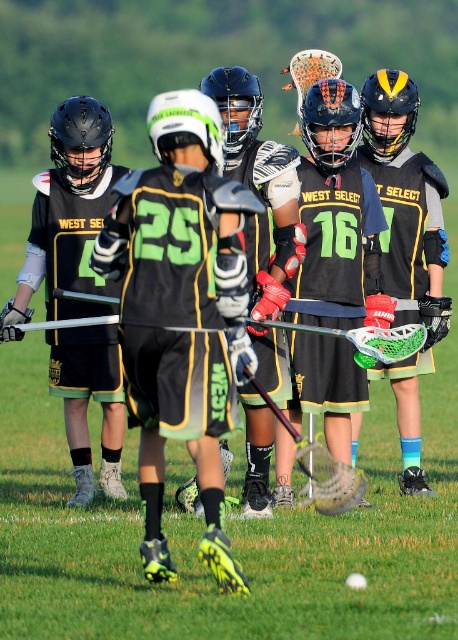
Can you confirm if black matte lacrosse stick at center is positioned above matte black helmet at center?

Indeed, black matte lacrosse stick at center is positioned over matte black helmet at center.

Who is positioned more to the right, black matte lacrosse stick at center or matte black helmet at center?

Positioned to the right is black matte lacrosse stick at center.

The width and height of the screenshot is (458, 640). What are the coordinates of `black matte lacrosse stick at center` in the screenshot? It's located at (228, 531).

This screenshot has width=458, height=640. I want to click on black matte lacrosse stick at center, so click(x=228, y=531).